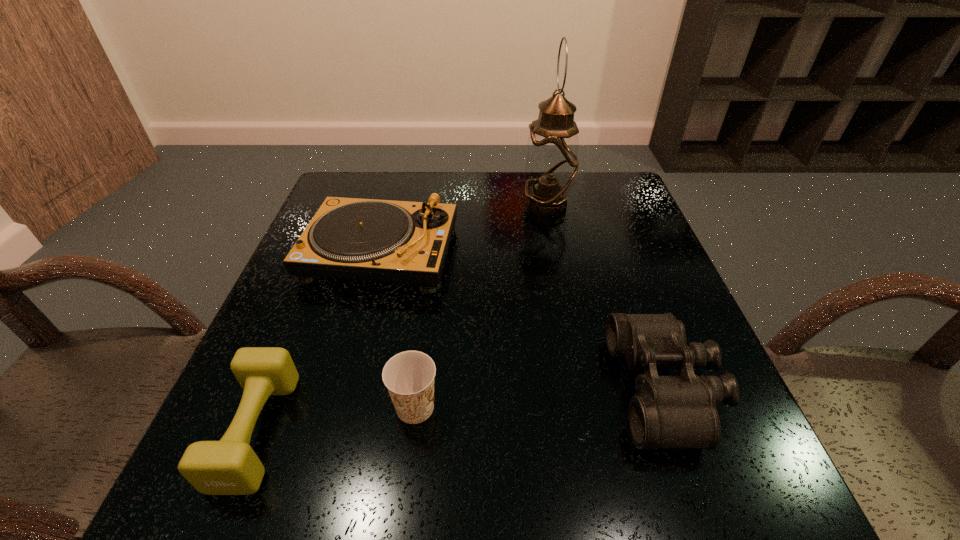
Select which object is the second closest to the Dixie cup. Please provide its 2D coordinates. Your answer should be formatted as a tuple, i.e. [(x, y)], where the tuple contains the x and y coordinates of a point satisfying the conditions above.

[(403, 242)]